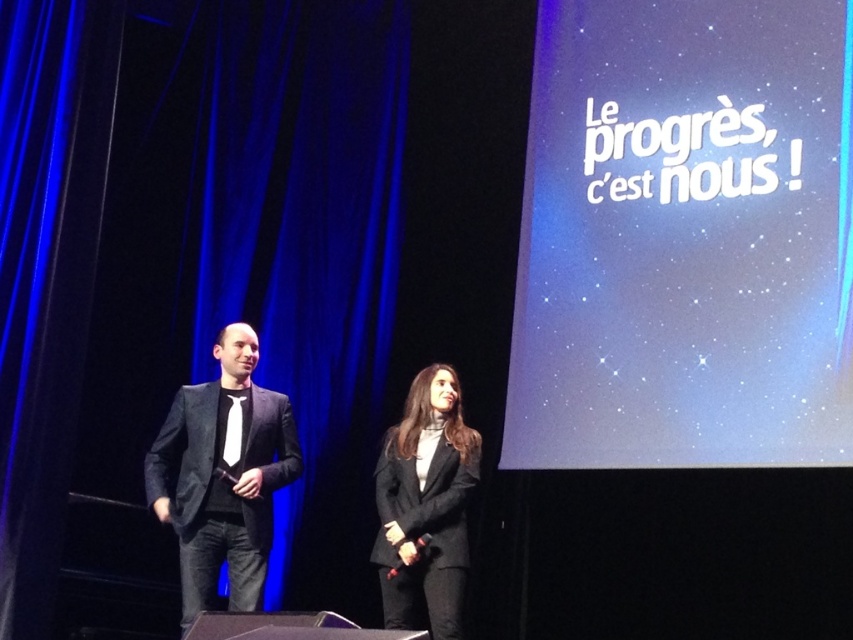
You are designing a poster for an event and need to ensure the matte white text at upper right and the matte black suit at left are visible. Based on the scene, which object might require more space horizontally to fit properly?

The matte white text at upper right might require more space horizontally as it is wider than the matte black suit at left.

You are an event planner trying to ensure the text on the screen is visible to all attendees. Based on the scene, is the matte white text at upper right positioned above or below the black matte blazer at center?

The matte white text at upper right is positioned above the black matte blazer at center according to the description.